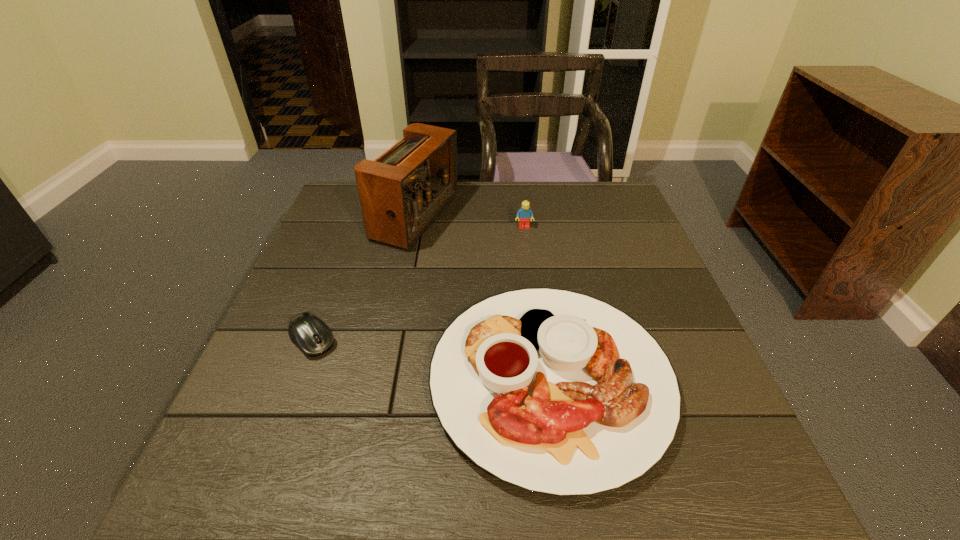
At what (x,y) coordinates should I click in order to perform the action: click on vacant space that is in between the platter and the radio receiver. Please return your answer as a coordinate pair (x, y). Looking at the image, I should click on (483, 299).

You are a GUI agent. You are given a task and a screenshot of the screen. Output one action in this format:
    pyautogui.click(x=<x>, y=<y>)
    Task: Click on the free area in between the platter and the radio receiver
    The height and width of the screenshot is (540, 960).
    Given the screenshot: What is the action you would take?
    pyautogui.click(x=483, y=299)

This screenshot has width=960, height=540. I want to click on vacant point located between the Lego and the radio receiver, so click(469, 222).

I want to click on vacant region between the tallest object and the shortest object, so click(x=364, y=279).

The width and height of the screenshot is (960, 540). I want to click on empty space between the mouse and the tallest object, so click(364, 279).

Choose which object is the third nearest neighbor to the Lego. Please provide its 2D coordinates. Your answer should be formatted as a tuple, i.e. [(x, y)], where the tuple contains the x and y coordinates of a point satisfying the conditions above.

[(310, 334)]

Locate an element on the screen. The width and height of the screenshot is (960, 540). object that can be found as the third closest to the Lego is located at coordinates (310, 334).

Locate an element on the screen. The width and height of the screenshot is (960, 540). free space that satisfies the following two spatial constraints: 1. on the face of the platter; 2. on the right side of the third shortest object is located at coordinates (544, 380).

In order to click on vacant area in the image that satisfies the following two spatial constraints: 1. on the face of the platter; 2. on the right side of the third shortest object in this screenshot , I will do `click(544, 380)`.

Locate an element on the screen. vacant space that satisfies the following two spatial constraints: 1. on the face of the platter; 2. on the right side of the Lego is located at coordinates (544, 380).